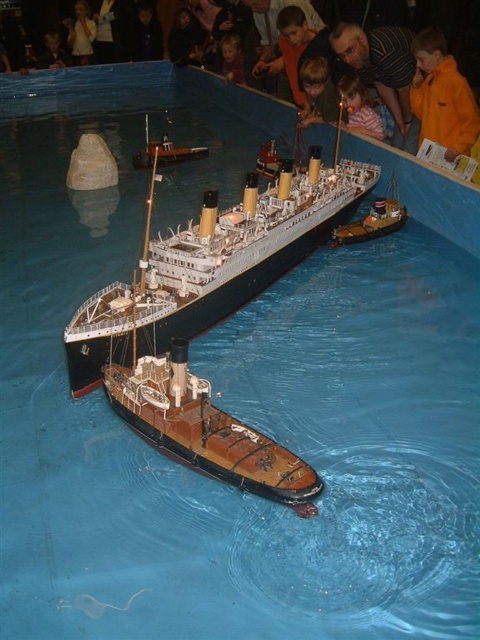
Question: Is orange fleece jacket at upper right further to the viewer compared to smooth skin child at upper center?

Choices:
 (A) yes
 (B) no

Answer: (B)

Question: Considering the real-world distances, which object is closest to the wooden ship at center?

Choices:
 (A) smooth skin child at upper center
 (B) polished wood ship at center
 (C) smooth skin child at center
 (D) orange fleece jacket at upper right

Answer: (B)

Question: Does polished wood ship at center come behind smooth skin child at center?

Choices:
 (A) no
 (B) yes

Answer: (A)

Question: Which point appears farthest from the camera in this image?

Choices:
 (A) (348, 106)
 (B) (334, 237)

Answer: (A)

Question: Is orange fleece jacket at upper right wider than wooden ship at center?

Choices:
 (A) no
 (B) yes

Answer: (A)

Question: Which point is farther to the camera?

Choices:
 (A) smooth skin child at upper center
 (B) wooden ship at center
 (C) smooth skin child at center
 (D) polished wood ship at center

Answer: (C)